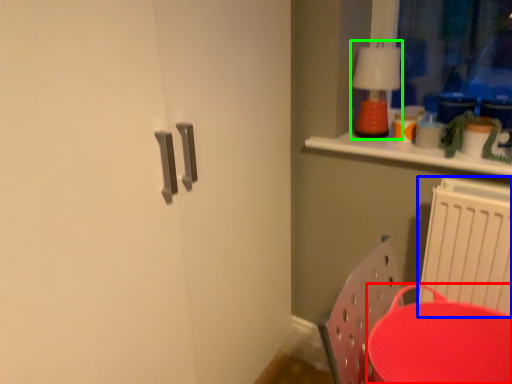
Question: Considering the real-world distances, which object is farthest from round table (highlighted by a red box)? radiator (highlighted by a blue box) or lamp (highlighted by a green box)?

Choices:
 (A) radiator
 (B) lamp

Answer: (B)